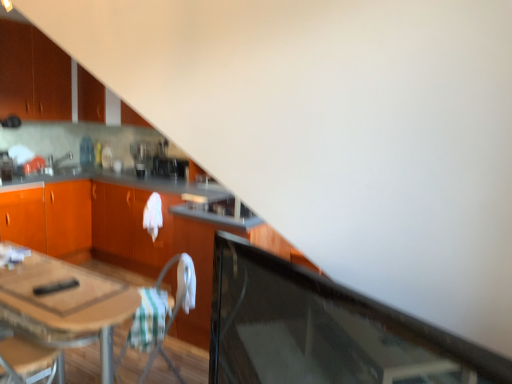
Question: Should I look upward or downward to see white fabric folding chair at center?

Choices:
 (A) down
 (B) up

Answer: (A)

Question: Could you tell me if green striped fabric at lower center is facing metallic silver toaster at left, which is counted as the 1th appliance, starting from the left?

Choices:
 (A) yes
 (B) no

Answer: (B)

Question: Is green striped fabric at lower center looking in the opposite direction of metallic silver toaster at left, acting as the 1th appliance starting from the front?

Choices:
 (A) yes
 (B) no

Answer: (B)

Question: From a real-world perspective, is green striped fabric at lower center below metallic silver toaster at left, acting as the 2th appliance starting from the right?

Choices:
 (A) yes
 (B) no

Answer: (A)

Question: Would you say green striped fabric at lower center is a long distance from metallic silver toaster at left, acting as the 1th appliance starting from the front?

Choices:
 (A) yes
 (B) no

Answer: (A)

Question: Does green striped fabric at lower center have a greater height compared to metallic silver toaster at left, acting as the 1th appliance starting from the front?

Choices:
 (A) no
 (B) yes

Answer: (B)

Question: From the image's perspective, is green striped fabric at lower center below metallic silver toaster at left, the second appliance in the back-to-front sequence?

Choices:
 (A) yes
 (B) no

Answer: (A)

Question: Is matte orange cabinet at upper left, acting as the second cabinetry starting from the top, oriented away from matte orange cabinet at upper left, marked as the 1th cabinetry in a top-to-bottom arrangement?

Choices:
 (A) no
 (B) yes

Answer: (B)

Question: From the image's perspective, is matte orange cabinet at upper left, acting as the second cabinetry starting from the top, below matte orange cabinet at upper left, the 3th cabinetry from the bottom?

Choices:
 (A) yes
 (B) no

Answer: (A)

Question: From the image's perspective, is matte orange cabinet at upper left, which is the second cabinetry from bottom to top, above matte orange cabinet at upper left, the 3th cabinetry from the bottom?

Choices:
 (A) no
 (B) yes

Answer: (A)

Question: Is matte orange cabinet at upper left, which is the second cabinetry from bottom to top, at the left side of matte orange cabinet at upper left, the 3th cabinetry from the bottom?

Choices:
 (A) no
 (B) yes

Answer: (A)

Question: Is matte orange cabinet at upper left, acting as the second cabinetry starting from the top, further to camera compared to matte orange cabinet at upper left, the 3th cabinetry from the bottom?

Choices:
 (A) yes
 (B) no

Answer: (B)

Question: Does matte orange cabinet at upper left, which is the second cabinetry from bottom to top, have a lesser width compared to matte orange cabinet at upper left, the 3th cabinetry from the bottom?

Choices:
 (A) no
 (B) yes

Answer: (A)

Question: Is the depth of matte orange cabinet at upper left, the 3th cabinetry from the bottom, less than that of matte silver sink at upper left?

Choices:
 (A) yes
 (B) no

Answer: (A)